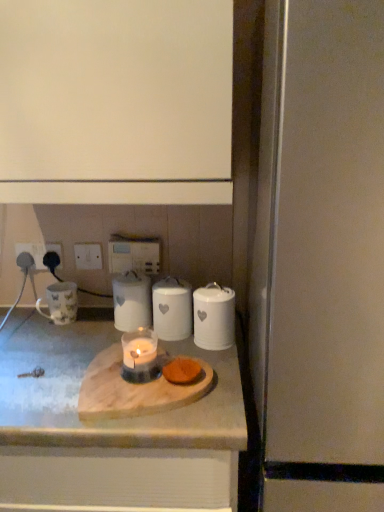
Find the location of a particular element. vacant region to the left of orange sponge at center is located at coordinates (93, 392).